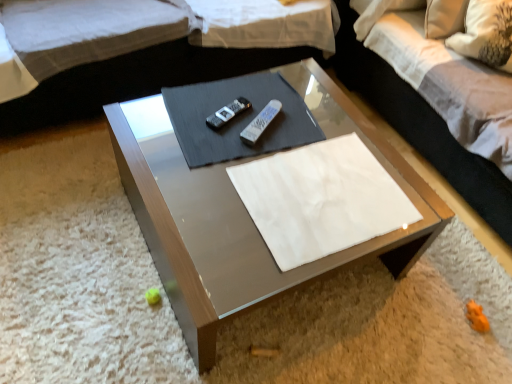
Locate an element on the screen. free spot in front of white plastic remote at center, acting as the 1th remote starting from the right is located at coordinates (260, 162).